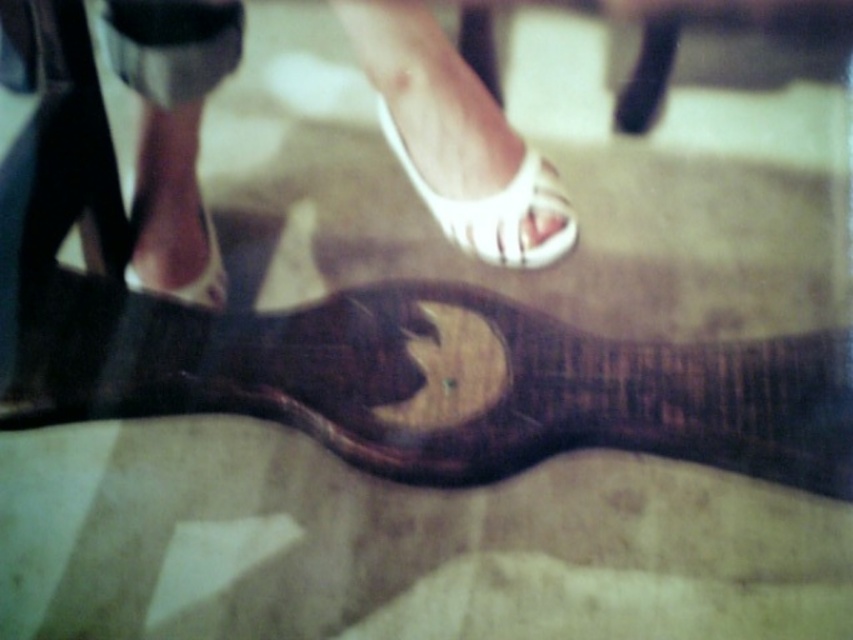
Question: Does white leather sandals at upper center appear on the left side of matte black high-heeled shoe at left?

Choices:
 (A) no
 (B) yes

Answer: (A)

Question: Which point is closer to the camera?

Choices:
 (A) matte black high-heeled shoe at left
 (B) white matte sandal at center
 (C) wooden acoustic guitar at center
 (D) white leather sandals at upper center

Answer: (C)

Question: Which point is closer to the camera?

Choices:
 (A) (527, 346)
 (B) (160, 262)
 (C) (564, 230)
 (D) (177, 67)

Answer: (A)

Question: Does wooden acoustic guitar at center have a larger size compared to white leather sandals at upper center?

Choices:
 (A) yes
 (B) no

Answer: (B)

Question: Which point is closer to the camera taking this photo?

Choices:
 (A) click(x=125, y=266)
 (B) click(x=514, y=260)
 (C) click(x=393, y=56)
 (D) click(x=601, y=397)

Answer: (D)

Question: Does wooden acoustic guitar at center have a smaller size compared to matte black high-heeled shoe at left?

Choices:
 (A) yes
 (B) no

Answer: (B)